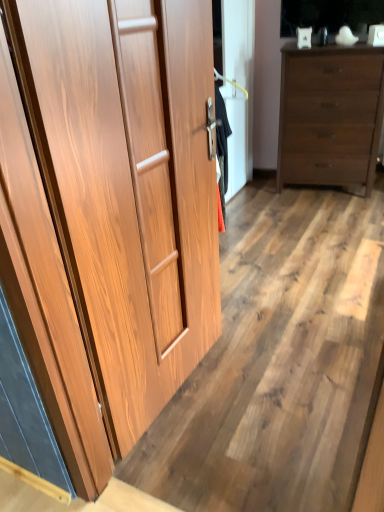
This screenshot has width=384, height=512. What do you see at coordinates (127, 185) in the screenshot?
I see `wooden cupboard at left` at bounding box center [127, 185].

At what (x,y) coordinates should I click in order to perform the action: click on wooden cupboard at left. Please return your answer as a coordinate pair (x, y). Looking at the image, I should click on (127, 185).

Where is `wooden cupboard at left`? wooden cupboard at left is located at coordinates (127, 185).

Is wooden floor at center at the back of wooden cupboard at left?

No, wooden cupboard at left is not facing the opposite direction of wooden floor at center.

What are the coordinates of `cupboard below the wooden floor at center (from the image's perspective)` in the screenshot? It's located at (127, 185).

Is wooden cupboard at left taller than wooden floor at center?

Correct, wooden cupboard at left is much taller as wooden floor at center.

Consider the image. Which object is further away from the camera taking this photo, matte brown dresser at right or wooden floor at center?

matte brown dresser at right.

How distant is matte brown dresser at right from wooden floor at center?

matte brown dresser at right is 3.95 feet from wooden floor at center.

Is matte brown dresser at right touching wooden floor at center?

matte brown dresser at right and wooden floor at center are not in contact.

Would you say matte brown dresser at right contains wooden floor at center?

No, matte brown dresser at right does not contain wooden floor at center.

Considering the positions of objects wooden cupboard at left and matte brown dresser at right in the image provided, who is more to the right, wooden cupboard at left or matte brown dresser at right?

Positioned to the right is matte brown dresser at right.

Is wooden cupboard at left touching matte brown dresser at right?

No, wooden cupboard at left is not making contact with matte brown dresser at right.

Looking at their sizes, would you say wooden cupboard at left is wider or thinner than matte brown dresser at right?

wooden cupboard at left is thinner than matte brown dresser at right.

Based on the photo, does wooden cupboard at left lie in front of matte brown dresser at right?

Yes, it is.

Which of these two, wooden floor at center or wooden cupboard at left, is wider?

With larger width is wooden floor at center.

Which point is more distant from viewer, (339,510) or (105,76)?

The point (339,510) is farther from the camera.

Between wooden floor at center and wooden cupboard at left, which one is positioned behind?

wooden floor at center is further from the camera.

What's the angular difference between wooden floor at center and matte brown dresser at right's facing directions?

They differ by 11.4 degrees in their facing directions.

Measure the distance from wooden floor at center to matte brown dresser at right.

wooden floor at center and matte brown dresser at right are 3.95 feet apart from each other.

Is point (271, 410) positioned behind point (336, 135)?

No, it is in front of (336, 135).

Which object is positioned more to the right, wooden floor at center or matte brown dresser at right?

From the viewer's perspective, matte brown dresser at right appears more on the right side.

From a real-world perspective, is matte brown dresser at right beneath wooden cupboard at left?

Yes, from a real-world perspective, matte brown dresser at right is below wooden cupboard at left.

Which is behind, matte brown dresser at right or wooden cupboard at left?

matte brown dresser at right.

The height and width of the screenshot is (512, 384). Find the location of `chest of drawers behind the wooden cupboard at left`. chest of drawers behind the wooden cupboard at left is located at coordinates [x=330, y=115].

Is matte brown dresser at right oriented away from wooden cupboard at left?

No.

Where is `cupboard above the wooden floor at center (from a real-world perspective)`? The image size is (384, 512). cupboard above the wooden floor at center (from a real-world perspective) is located at coordinates (127, 185).

Image resolution: width=384 pixels, height=512 pixels. Find the location of `the chest of drawers above the wooden floor at center (from the image's perspective)`. the chest of drawers above the wooden floor at center (from the image's perspective) is located at coordinates click(330, 115).

Considering their positions, is matte brown dresser at right positioned closer to wooden floor at center than wooden cupboard at left?

wooden cupboard at left lies closer to wooden floor at center than the other object.

From the image, which object appears to be farther from wooden floor at center, wooden cupboard at left or matte brown dresser at right?

matte brown dresser at right is further to wooden floor at center.

From the image, which object appears to be farther from matte brown dresser at right, wooden floor at center or wooden cupboard at left?

wooden cupboard at left lies further to matte brown dresser at right than the other object.

From the image, which object appears to be nearer to wooden cupboard at left, matte brown dresser at right or wooden floor at center?

wooden floor at center is closer to wooden cupboard at left.

When comparing their distances from matte brown dresser at right, does wooden cupboard at left or wooden floor at center seem closer?

Among the two, wooden floor at center is located nearer to matte brown dresser at right.

Which object lies further to the anchor point wooden cupboard at left, wooden floor at center or matte brown dresser at right?

matte brown dresser at right is positioned further to the anchor wooden cupboard at left.

The height and width of the screenshot is (512, 384). Identify the location of plywood between wooden cupboard at left and matte brown dresser at right from front to back. tap(279, 362).